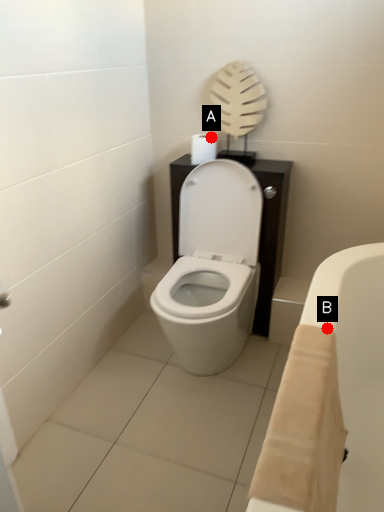
Question: Two points are circled on the image, labeled by A and B beside each circle. Which of the following is the closest to the observer?

Choices:
 (A) A is closer
 (B) B is closer

Answer: (B)